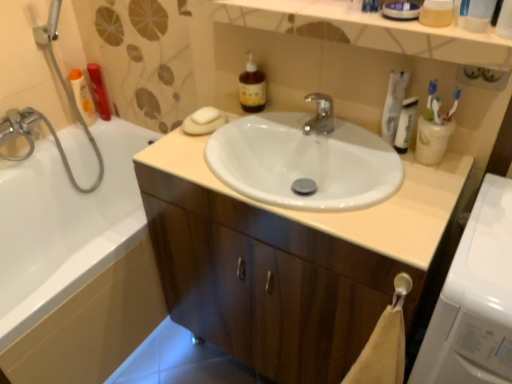
Identify the location of vacant area that is in front of white glossy tube at upper right. (404, 183).